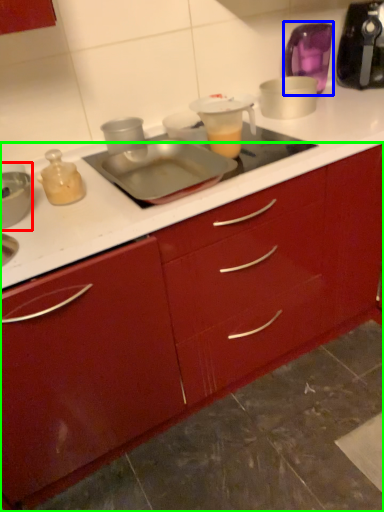
Question: Which object is positioned farthest from appliance (highlighted by a red box)? Select from appliance (highlighted by a blue box) and cabinetry (highlighted by a green box).

Choices:
 (A) appliance
 (B) cabinetry

Answer: (A)